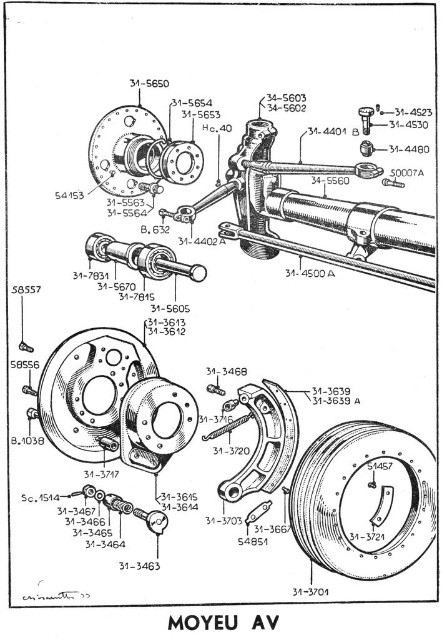
Can you confirm if matte black telescope at center is positioned to the right of matte silver rod at center?

Yes, matte black telescope at center is to the right of matte silver rod at center.

Is matte black telescope at center closer to camera compared to matte silver rod at center?

Yes.

Between point (286, 193) and point (182, 269), which one is positioned in front?

Point (182, 269) is in front.

In order to click on matte black telescope at center in this screenshot , I will do coord(311,211).